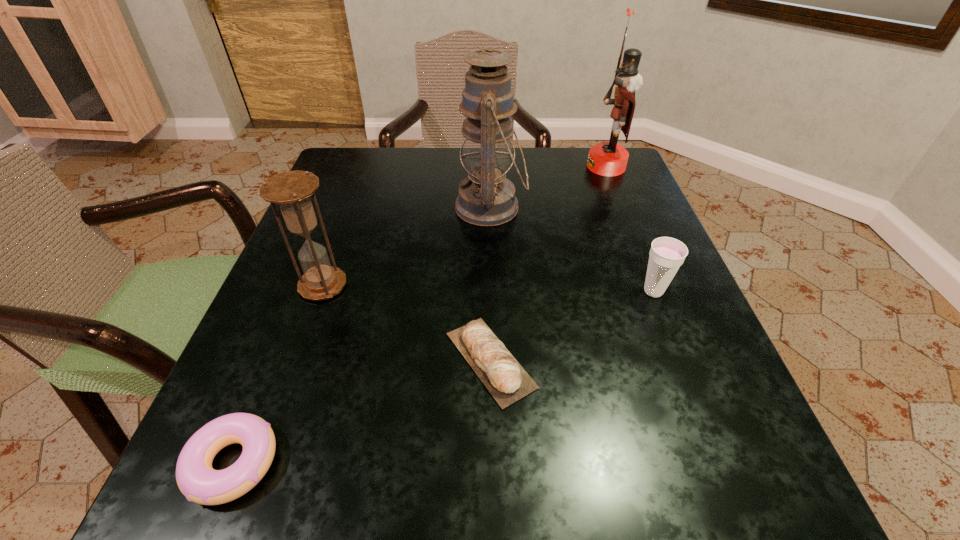
This screenshot has width=960, height=540. Find the location of `cup located in the right edge section of the desktop`. cup located in the right edge section of the desktop is located at coordinates [x=667, y=254].

Where is `object at the near left corner`? Image resolution: width=960 pixels, height=540 pixels. object at the near left corner is located at coordinates point(197,480).

The height and width of the screenshot is (540, 960). I want to click on object that is at the far right corner, so click(x=606, y=158).

Locate an element on the screen. The height and width of the screenshot is (540, 960). blank space at the far edge of the desktop is located at coordinates (561, 163).

This screenshot has height=540, width=960. I want to click on free space at the near edge of the desktop, so click(503, 459).

You are a GUI agent. You are given a task and a screenshot of the screen. Output one action in this format:
    pyautogui.click(x=<x>, y=<y>)
    Task: Click on the blank space at the left edge of the desktop
    This screenshot has height=540, width=960.
    Given the screenshot: What is the action you would take?
    pyautogui.click(x=333, y=227)

Find the location of `vacant space at the right edge of the desktop`. vacant space at the right edge of the desktop is located at coordinates (648, 314).

The width and height of the screenshot is (960, 540). In the image, there is a desktop. In order to click on vacant space at the far left corner in this screenshot , I will do `click(329, 190)`.

Where is `free space at the far right corner of the desktop`? free space at the far right corner of the desktop is located at coordinates (588, 151).

The image size is (960, 540). Find the location of `vacant area between the doughnut and the fifth nearest object`. vacant area between the doughnut and the fifth nearest object is located at coordinates (362, 335).